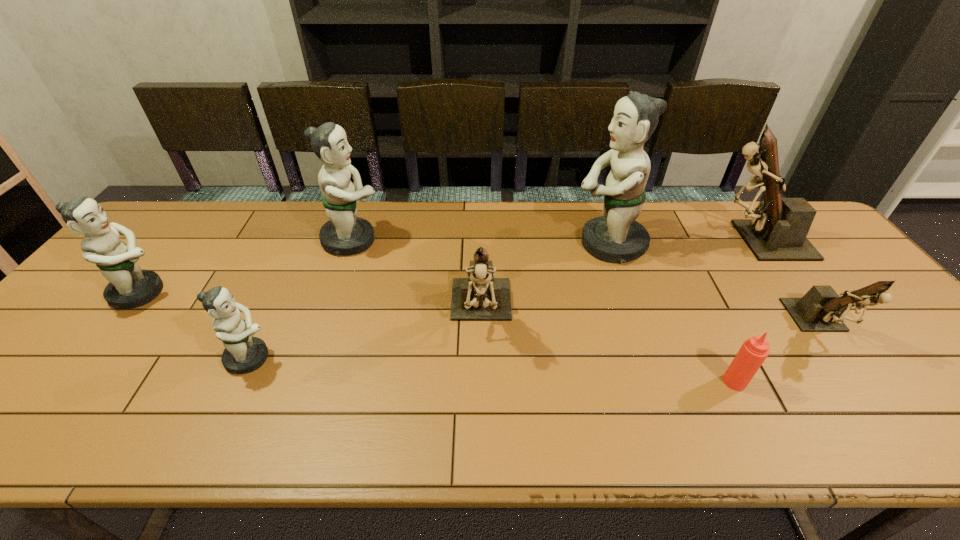
This screenshot has width=960, height=540. Find the location of `the shortest object`. the shortest object is located at coordinates (x=754, y=351).

Image resolution: width=960 pixels, height=540 pixels. I want to click on Tabasco sauce, so click(x=754, y=351).

Locate an element on the screen. vacant space located on the front-facing side of the tallest figurine is located at coordinates (459, 244).

Locate an element on the screen. Image resolution: width=960 pixels, height=540 pixels. vacant area located 0.370m on the front-facing side of the tallest figurine is located at coordinates (449, 244).

In order to click on vacant space positioned on the front-facing side of the tallest figurine in this screenshot , I will do `click(472, 244)`.

Locate an element on the screen. This screenshot has height=540, width=960. vacant space located on the front-facing side of the third smallest green figurine is located at coordinates (458, 240).

Where is `free space located 0.070m on the front-facing side of the farthest brown figurine`? free space located 0.070m on the front-facing side of the farthest brown figurine is located at coordinates (683, 240).

Identify the location of vacant space located on the front-facing side of the farthest brown figurine. The image size is (960, 540). (624, 240).

Where is `free space located 0.270m on the front-facing side of the farthest brown figurine`? The height and width of the screenshot is (540, 960). free space located 0.270m on the front-facing side of the farthest brown figurine is located at coordinates (617, 240).

In order to click on free space located 0.330m on the front-facing side of the leftmost object in this screenshot , I will do `click(291, 293)`.